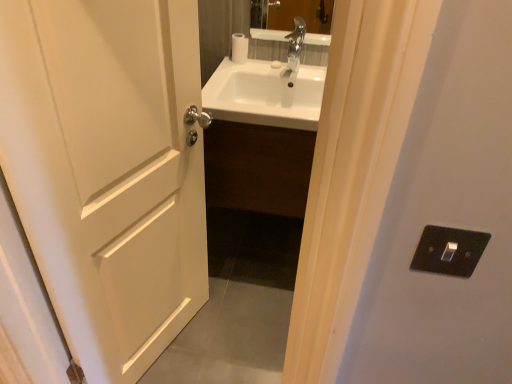
Find the location of a particular element. black plastic switch at right is located at coordinates (446, 218).

This screenshot has height=384, width=512. What do you see at coordinates (446, 218) in the screenshot?
I see `black plastic switch at right` at bounding box center [446, 218].

Describe the element at coordinates (108, 169) in the screenshot. I see `white matte door at left` at that location.

I want to click on white matte toilet paper at upper center, so click(239, 48).

From a real-world perspective, between black plastic switch at right and white matte door at left, who is vertically higher?

black plastic switch at right is physically above.

Based on their sizes in the image, would you say black plastic switch at right is bigger or smaller than white matte door at left?

Clearly, black plastic switch at right is smaller in size than white matte door at left.

In the image, is black plastic switch at right on the left side or the right side of white matte door at left?

Based on their positions, black plastic switch at right is located to the right of white matte door at left.

Can you confirm if black plastic switch at right is wider than white matte door at left?

Yes.

Is white glossy sink at center smaller than black plastic switch at right?

Incorrect, white glossy sink at center is not smaller in size than black plastic switch at right.

How different are the orientations of white glossy sink at center and black plastic switch at right in degrees?

There is a 175-degree angle between the facing directions of white glossy sink at center and black plastic switch at right.

Which object is further away from the camera, white glossy sink at center or black plastic switch at right?

white glossy sink at center is further from the camera.

From the image's perspective, which object appears higher, white glossy sink at center or black plastic switch at right?

white glossy sink at center.

The width and height of the screenshot is (512, 384). I want to click on door below the black plastic switch at right (from the image's perspective), so click(x=108, y=169).

From a real-world perspective, which is physically above, white matte door at left or black plastic switch at right?

In real-world perspective, black plastic switch at right is above.

Who is smaller, white matte door at left or black plastic switch at right?

Smaller between the two is black plastic switch at right.

From a real-world perspective, who is located lower, white matte toilet paper at upper center or white glossy sink at center?

white glossy sink at center, from a real-world perspective.

Which of these two, white matte toilet paper at upper center or white glossy sink at center, is smaller?

With smaller size is white matte toilet paper at upper center.

Does point (247, 54) come behind point (280, 210)?

Yes, point (247, 54) is behind point (280, 210).

How much distance is there between white matte toilet paper at upper center and white glossy sink at center?

white matte toilet paper at upper center is 20.35 inches from white glossy sink at center.

Could you tell me if white matte toilet paper at upper center is facing white matte door at left?

Yes, white matte toilet paper at upper center is turned towards white matte door at left.

Is white matte toilet paper at upper center thinner than white matte door at left?

Yes.

Does white matte toilet paper at upper center come behind white matte door at left?

That is True.

Which object is positioned more to the right, white matte door at left or white matte toilet paper at upper center?

Positioned to the right is white matte toilet paper at upper center.

In the scene shown: Which of these two, white matte door at left or white matte toilet paper at upper center, is wider?

Wider between the two is white matte door at left.

Do you think white matte door at left is within white matte toilet paper at upper center, or outside of it?

white matte door at left is outside white matte toilet paper at upper center.

Which object is further away from the camera, white matte door at left or white matte toilet paper at upper center?

white matte toilet paper at upper center.

Does white matte door at left have a greater height compared to white glossy sink at center?

Yes, white matte door at left is taller than white glossy sink at center.

From a real-world perspective, who is located lower, white matte door at left or white glossy sink at center?

In real-world perspective, white glossy sink at center is lower.

Is white matte door at left directly adjacent to white glossy sink at center?

No, white matte door at left is not with white glossy sink at center.

In the scene shown: Relative to white glossy sink at center, is white matte door at left in front or behind?

Clearly, white matte door at left is in front of white glossy sink at center.

Where is `door behind the black plastic switch at right`? The width and height of the screenshot is (512, 384). door behind the black plastic switch at right is located at coordinates (108, 169).

At what (x,y) coordinates should I click in order to perform the action: click on cabinetry on the left of black plastic switch at right. Please return your answer as a coordinate pair (x, y). Looking at the image, I should click on [x=258, y=167].

When comparing their distances from black plastic switch at right, does white glossy sink at center or white matte door at left seem closer?

white matte door at left is closer to black plastic switch at right.

Which object lies further to the anchor point white matte door at left, white matte toilet paper at upper center or black plastic switch at right?

white matte toilet paper at upper center is positioned further to the anchor white matte door at left.

Based on the photo, considering their positions, is white matte toilet paper at upper center positioned closer to white glossy sink at center than black plastic switch at right?

The object closer to white glossy sink at center is white matte toilet paper at upper center.

Based on the photo, when comparing their distances from black plastic switch at right, does white matte toilet paper at upper center or white matte door at left seem closer?

white matte door at left.

Considering their positions, is white matte door at left positioned further to black plastic switch at right than white matte toilet paper at upper center?

white matte toilet paper at upper center.

Considering their positions, is black plastic switch at right positioned further to white glossy sink at center than white matte toilet paper at upper center?

black plastic switch at right is further to white glossy sink at center.

Considering their positions, is white matte door at left positioned closer to white matte toilet paper at upper center than white glossy sink at center?

white glossy sink at center is closer to white matte toilet paper at upper center.

Looking at the image, which one is located further to white glossy sink at center, white matte toilet paper at upper center or white matte door at left?

white matte toilet paper at upper center lies further to white glossy sink at center than the other object.

At what (x,y) coordinates should I click in order to perform the action: click on cabinetry located between white matte door at left and white matte toilet paper at upper center in the depth direction. Please return your answer as a coordinate pair (x, y). The width and height of the screenshot is (512, 384). Looking at the image, I should click on (258, 167).

At what (x,y) coordinates should I click in order to perform the action: click on door between black plastic switch at right and white matte toilet paper at upper center along the z-axis. Please return your answer as a coordinate pair (x, y). The image size is (512, 384). Looking at the image, I should click on (108, 169).

Identify the location of door located between black plastic switch at right and white glossy sink at center in the depth direction. (108, 169).

This screenshot has height=384, width=512. I want to click on cabinetry between black plastic switch at right and white matte toilet paper at upper center in the front-back direction, so click(x=258, y=167).